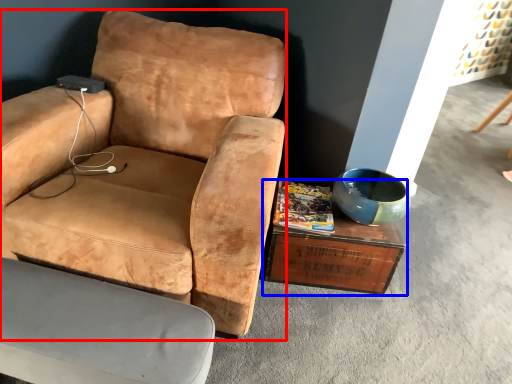
Question: Which point is further to the camera, chair (highlighted by a red box) or coffee table (highlighted by a blue box)?

Choices:
 (A) chair
 (B) coffee table

Answer: (B)